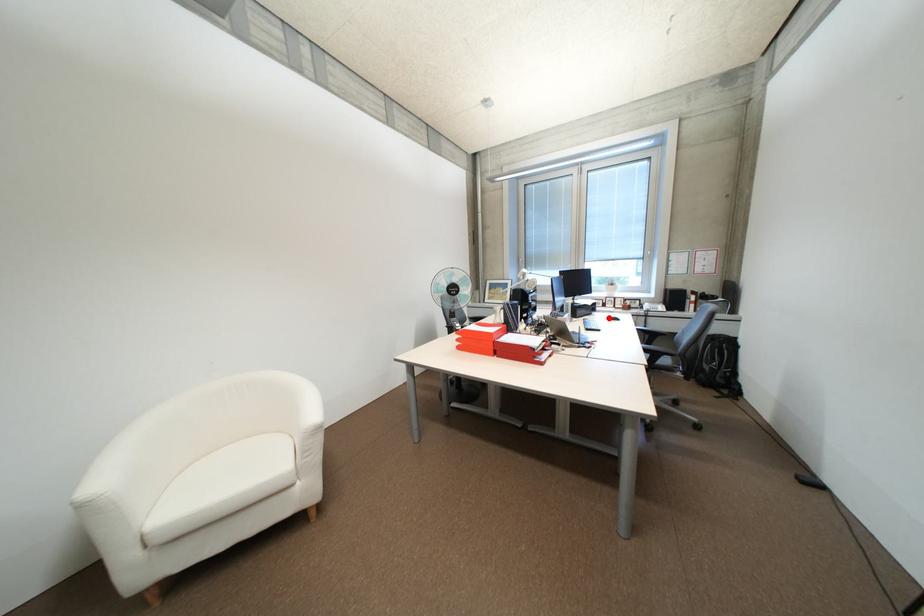
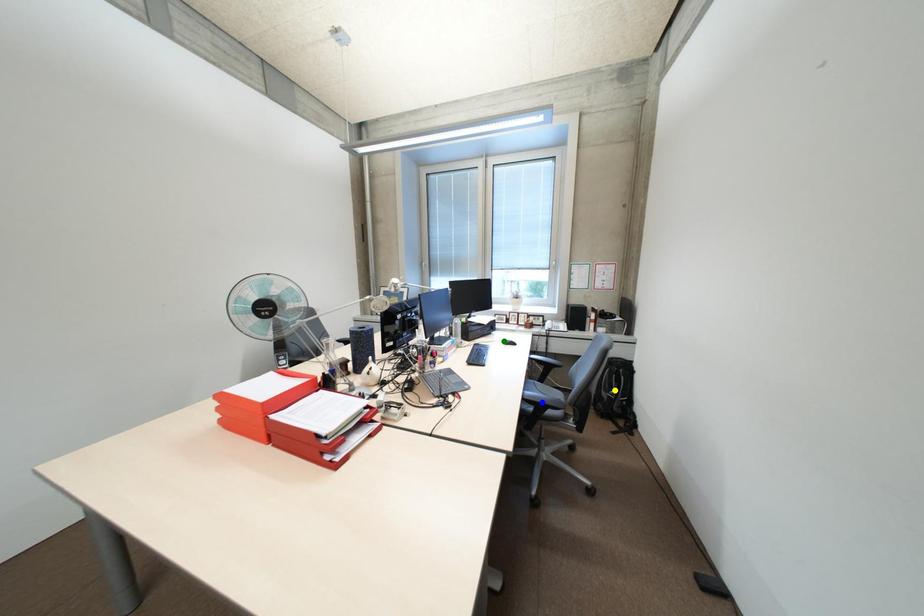
Question: I am providing you with two images of the same scene from different viewpoints. A red point is marked on the first image. You are given multiple points on the second image. Which point in image 2 is actually the same real-world point as the red point in image 1?

Choices:
 (A) yellow point
 (B) green point
 (C) blue point

Answer: (B)